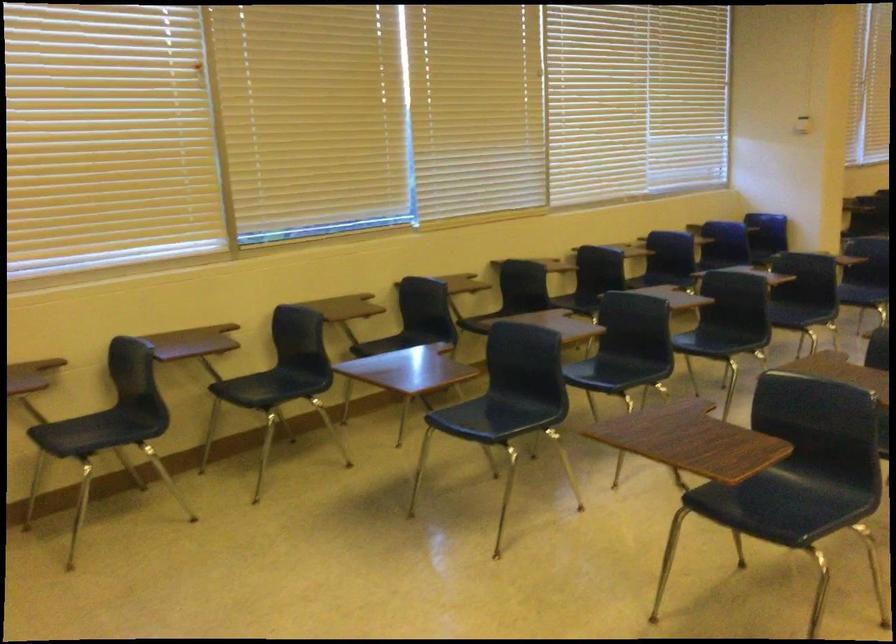
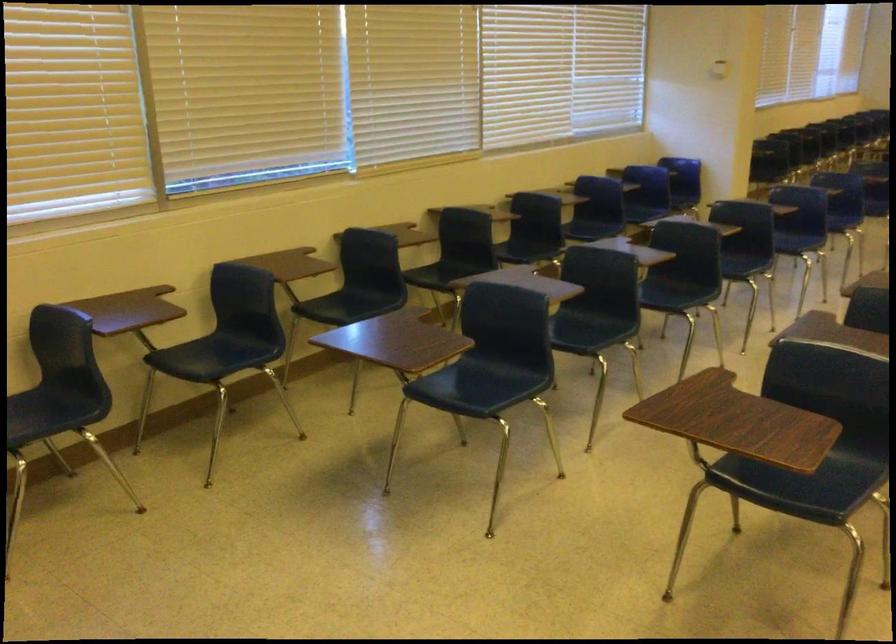
Locate, in the second image, the point that corresponds to point 486,418 in the first image.

(467, 386)